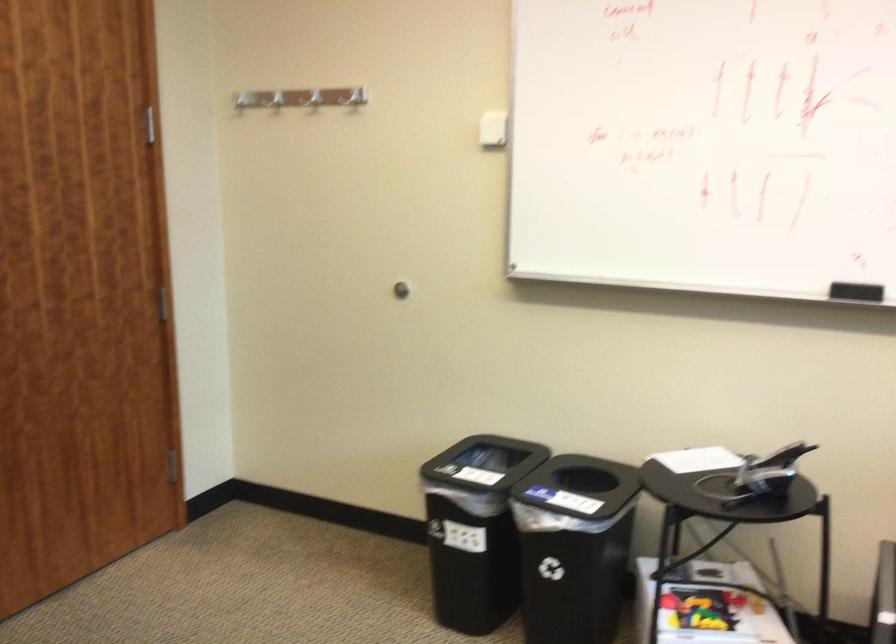
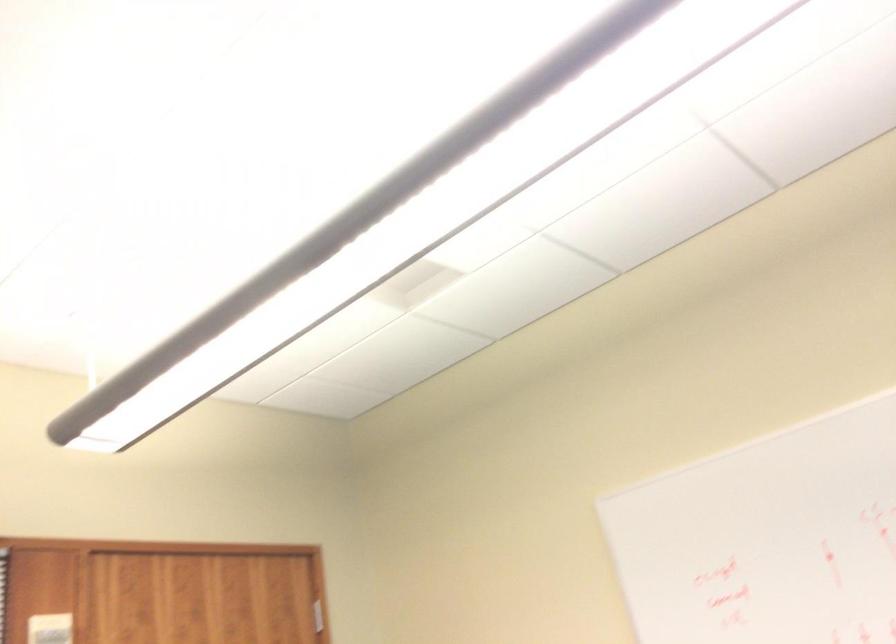
Question: How did the camera likely rotate?

Choices:
 (A) Left
 (B) Right
 (C) Up
 (D) Down

Answer: (C)